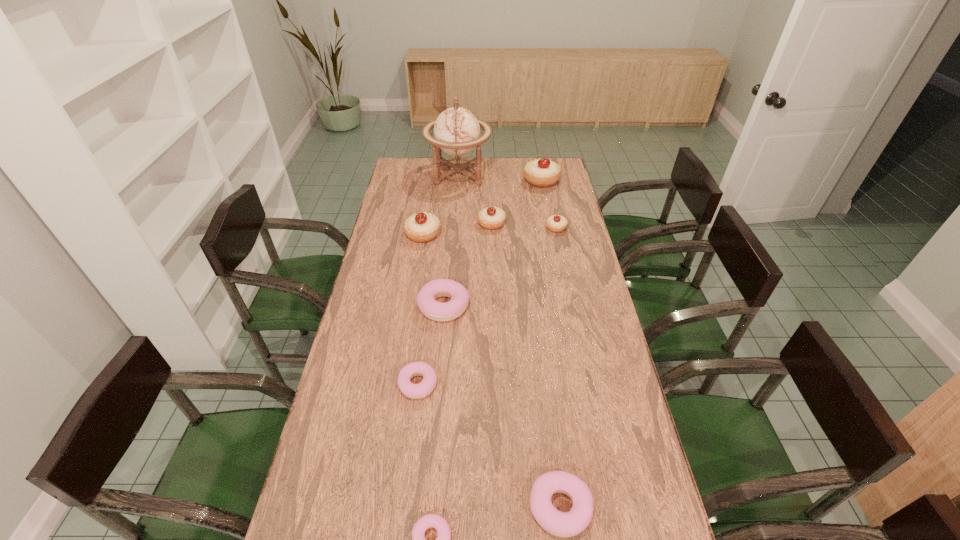
Locate an element on the screen. globe is located at coordinates (456, 130).

Find the location of `the biggest beige pastry`. the biggest beige pastry is located at coordinates (543, 172).

At what (x,y) coordinates should I click in order to perform the action: click on the tallest pastry. Please return your answer as a coordinate pair (x, y). This screenshot has width=960, height=540. Looking at the image, I should click on (543, 172).

What are the coordinates of `the third smallest beige pastry` in the screenshot? It's located at (422, 227).

Image resolution: width=960 pixels, height=540 pixels. I want to click on the second tallest pastry, so click(422, 227).

Where is `the second smallest beige pastry`? This screenshot has width=960, height=540. the second smallest beige pastry is located at coordinates (491, 218).

Locate an element on the screen. The image size is (960, 540). the fifth pastry from left to right is located at coordinates (491, 218).

Where is `the smallest beige pastry`? The height and width of the screenshot is (540, 960). the smallest beige pastry is located at coordinates (555, 223).

At what (x,y) coordinates should I click in order to perform the action: click on the farthest pink pastry. Please return your answer as a coordinate pair (x, y). Looking at the image, I should click on (432, 309).

This screenshot has width=960, height=540. Find the location of `the sixth farthest object`. the sixth farthest object is located at coordinates (432, 309).